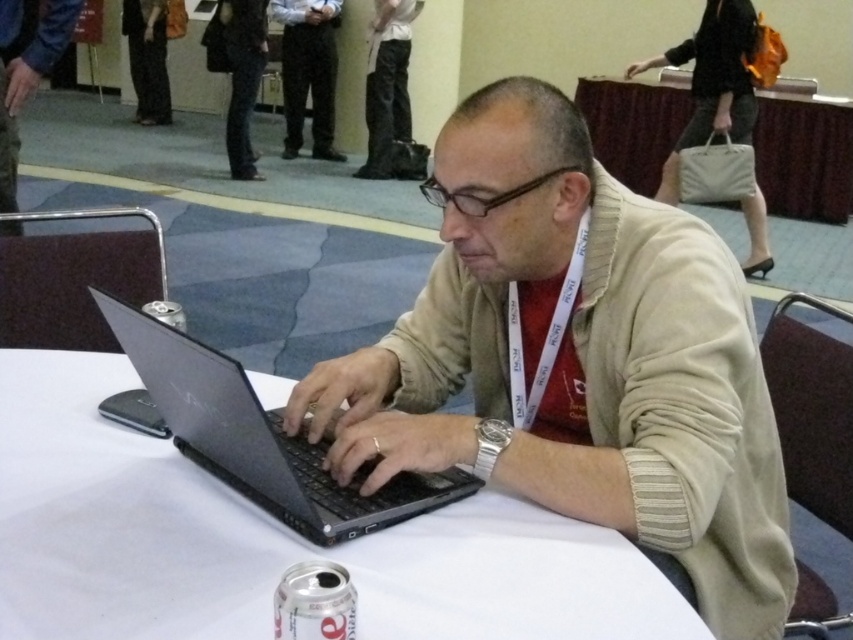
Is point (473, 497) closer to camera compared to point (1, 106)?

That is True.

Is point (250, 573) positioned after point (56, 6)?

That is False.

Find the location of `white cloth table at center`. white cloth table at center is located at coordinates (270, 541).

Image resolution: width=853 pixels, height=640 pixels. I want to click on white cloth table at center, so pos(270,541).

From the picture: Is matte black laptop at center smaller than dark gray pants at center?

Yes.

Is matte black laptop at center positioned in front of dark gray pants at center?

Yes, it is.

Does point (643, 429) lie in front of point (314, 134)?

Yes, point (643, 429) is closer to viewer.

Locate an element on the screen. The image size is (853, 640). matte black laptop at center is located at coordinates (579, 362).

Between white fabric table at upper center and matte black laptop at left, which one is positioned lower?

matte black laptop at left is lower down.

From the picture: Does white fabric table at upper center have a larger size compared to matte black laptop at left?

Correct, white fabric table at upper center is larger in size than matte black laptop at left.

What do you see at coordinates (804, 157) in the screenshot? I see `white fabric table at upper center` at bounding box center [804, 157].

This screenshot has height=640, width=853. I want to click on white fabric table at upper center, so click(x=804, y=157).